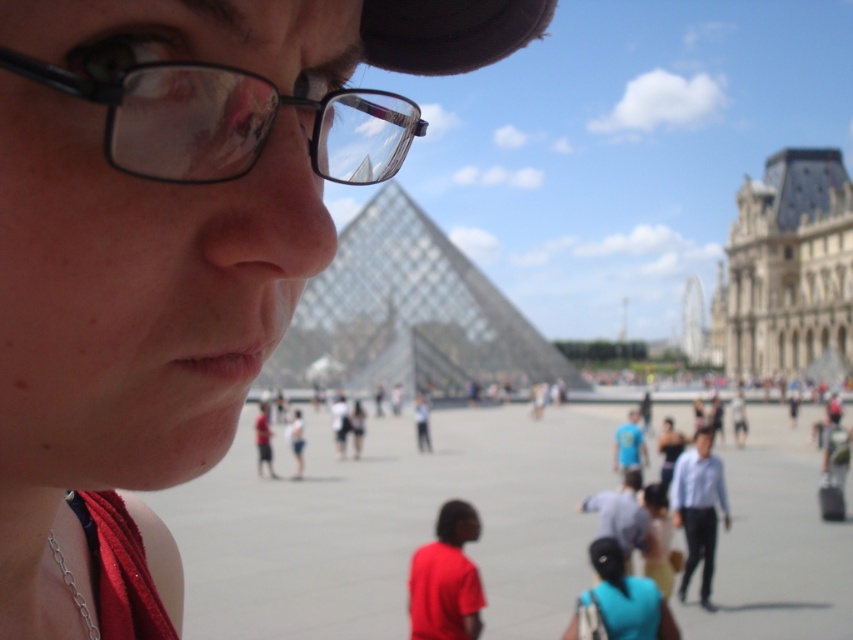
Question: Is matte black glasses at center behind black plastic glasses at upper left?

Choices:
 (A) no
 (B) yes

Answer: (A)

Question: Is matte black glasses at center to the left of black plastic glasses at upper left from the viewer's perspective?

Choices:
 (A) yes
 (B) no

Answer: (A)

Question: Among these objects, which one is nearest to the camera?

Choices:
 (A) black plastic glasses at upper left
 (B) matte black glasses at center

Answer: (B)

Question: Which of the following is the closest to the observer?

Choices:
 (A) (248, 76)
 (B) (102, 540)

Answer: (A)

Question: Is matte black glasses at center thinner than black plastic glasses at upper left?

Choices:
 (A) yes
 (B) no

Answer: (B)

Question: Among these objects, which one is nearest to the camera?

Choices:
 (A) black plastic glasses at upper left
 (B) matte black glasses at center

Answer: (B)